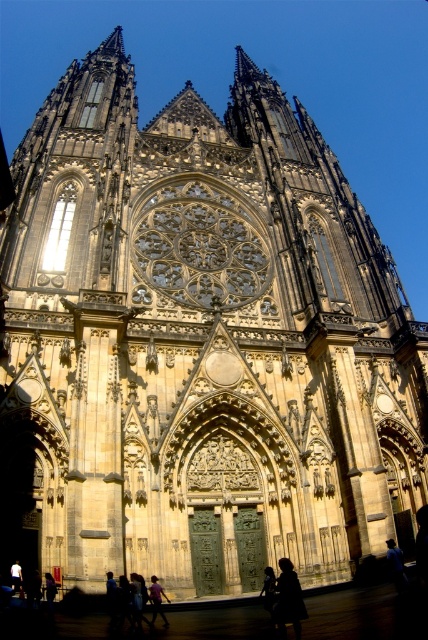
You are standing in front of St. Vitus Cathedral and want to take a photo of the dark blue jeans at center. Where should you position yourself to capture the jeans in the frame?

To capture the dark blue jeans at center, position yourself directly in front of the cathedral, centered horizontally and approximately 36.7 percent up from the bottom of the frame, as the jeans are located at point 0.938 on the x axis and 0.367 on the y axis according to the coordinate system where the bottom left corner is the origin.

You are standing in front of St. Vitus Cathedral and notice two people in the scene. One has dark hair at lower center and another wearing dark blue jeans at center. Which person is positioned higher from the ground?

The dark hair at lower center is located above dark blue jeans at center, so the person with dark hair at lower center is positioned higher from the ground.

You are a photographer standing in front of St. Vitus Cathedral. You notice a person with dark hair at lower center and dark blue jeans at center in your shot. Which object in your photo appears bigger?

The dark hair at lower center appears bigger than the dark blue jeans at center because it has a larger size compared to the dark blue jeans at center.